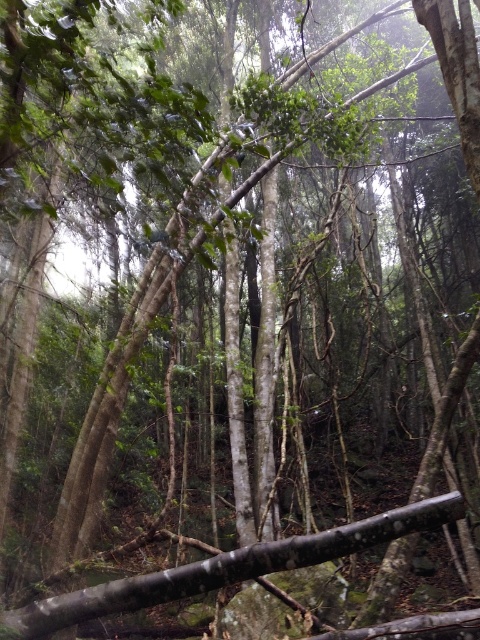
You are a hiker in the forest and need to step from the smooth brown branch at center to the smooth brown rock at center. Can you safely make this jump if your maximum jumping distance is 7 feet?

The distance between the smooth brown branch at center and the smooth brown rock at center is 8.08 feet, which exceeds your maximum jumping distance of 7 feet. Therefore, you cannot safely make this jump.

You are an explorer in the forest and need to decide whether to step on the smooth brown branch at center or the smooth brown rock at center. Which object is larger and safer to step on?

The smooth brown branch at center is bigger than the smooth brown rock at center, so it is safer to step on the smooth brown branch at center.